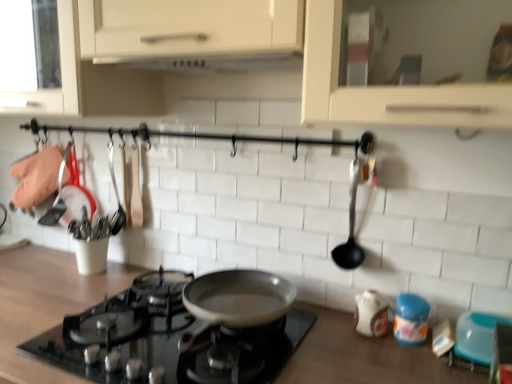
Question: Is wooden countertop at center far away from white matte exhaust hood at upper center?

Choices:
 (A) no
 (B) yes

Answer: (A)

Question: Can you see wooden countertop at center touching white matte exhaust hood at upper center?

Choices:
 (A) yes
 (B) no

Answer: (B)

Question: Does wooden countertop at center appear on the left side of white matte exhaust hood at upper center?

Choices:
 (A) no
 (B) yes

Answer: (B)

Question: From the image's perspective, is wooden countertop at center above white matte exhaust hood at upper center?

Choices:
 (A) yes
 (B) no

Answer: (B)

Question: Is wooden countertop at center positioned behind white matte exhaust hood at upper center?

Choices:
 (A) yes
 (B) no

Answer: (B)

Question: Is blue plastic bowl at lower right, the second appliance from the left, taller or shorter than black plastic spoon at right?

Choices:
 (A) short
 (B) tall

Answer: (A)

Question: Is blue plastic bowl at lower right, which appears as the 1th appliance when viewed from the right, in front of or behind black plastic spoon at right in the image?

Choices:
 (A) front
 (B) behind

Answer: (A)

Question: Looking at the image, does blue plastic bowl at lower right, which appears as the 1th appliance when viewed from the right, seem bigger or smaller compared to black plastic spoon at right?

Choices:
 (A) small
 (B) big

Answer: (A)

Question: Considering the positions of blue plastic bowl at lower right, which appears as the 1th appliance when viewed from the right, and black plastic spoon at right in the image, is blue plastic bowl at lower right, which appears as the 1th appliance when viewed from the right, wider or thinner than black plastic spoon at right?

Choices:
 (A) thin
 (B) wide

Answer: (B)

Question: Is black glass gas stove at center taller or shorter than wooden countertop at center?

Choices:
 (A) tall
 (B) short

Answer: (B)

Question: From the image's perspective, relative to wooden countertop at center, is black glass gas stove at center above or below?

Choices:
 (A) below
 (B) above

Answer: (B)

Question: Would you say black glass gas stove at center is inside or outside wooden countertop at center?

Choices:
 (A) inside
 (B) outside

Answer: (B)

Question: Based on their sizes in the image, would you say black glass gas stove at center is bigger or smaller than wooden countertop at center?

Choices:
 (A) big
 (B) small

Answer: (B)

Question: In terms of size, does black plastic spoon at right appear bigger or smaller than white matte exhaust hood at upper center?

Choices:
 (A) small
 (B) big

Answer: (A)

Question: Which is correct: black plastic spoon at right is inside white matte exhaust hood at upper center, or outside of it?

Choices:
 (A) outside
 (B) inside

Answer: (A)